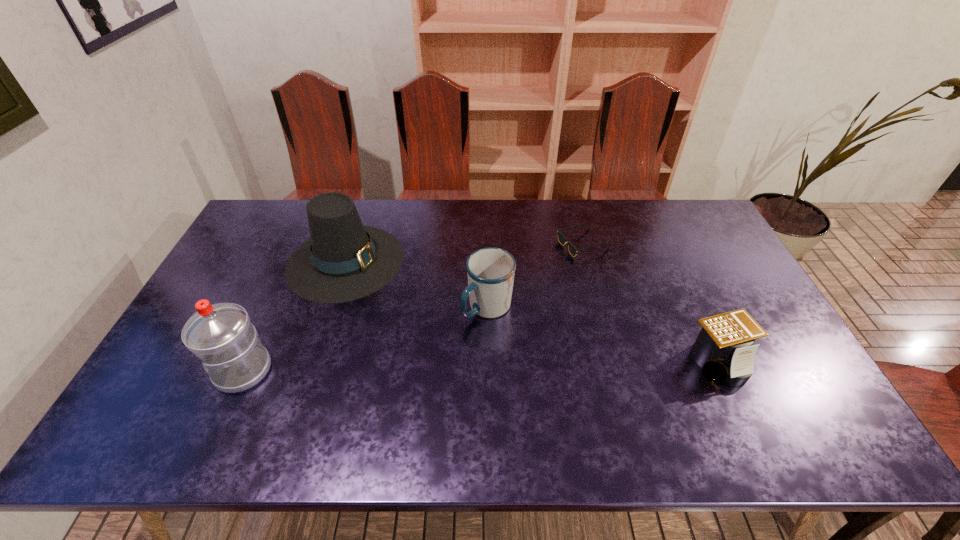
Identify the location of vacant area situated 0.280m on the lenses of the second object from right to left. This screenshot has width=960, height=540. (522, 308).

The height and width of the screenshot is (540, 960). I want to click on free region located on the lenses of the second object from right to left, so click(534, 296).

The height and width of the screenshot is (540, 960). In order to click on blank area located on the lenses of the second object from right to left in this screenshot , I will do `click(549, 279)`.

Locate an element on the screen. This screenshot has height=540, width=960. blank space located 0.290m on the handle side of the third shortest object is located at coordinates (401, 399).

The height and width of the screenshot is (540, 960). What are the coordinates of `vacant space positioned on the handle side of the third shortest object` in the screenshot? It's located at (443, 355).

I want to click on free point located 0.250m on the handle side of the third shortest object, so click(x=413, y=387).

Image resolution: width=960 pixels, height=540 pixels. I want to click on vacant region located 0.400m on the front-facing side of the hat, so coord(495,343).

Locate an element on the screen. The height and width of the screenshot is (540, 960). free spot located 0.320m on the front-facing side of the hat is located at coordinates pyautogui.click(x=471, y=330).

This screenshot has height=540, width=960. I want to click on vacant space located 0.250m on the front-facing side of the hat, so click(x=452, y=319).

Identify the location of sunglasses present at the far edge. (562, 239).